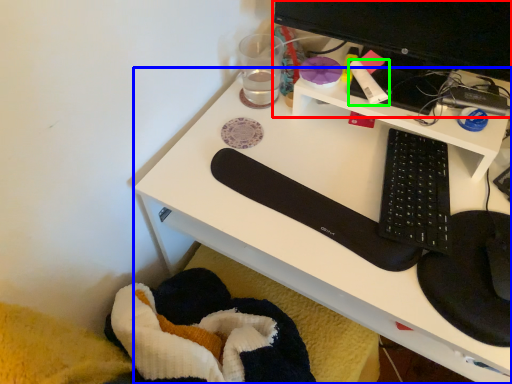
Question: Which object is positioned closest to desktop computer (highlighted by a red box)? Select from desk (highlighted by a blue box) and stationery (highlighted by a green box).

Choices:
 (A) desk
 (B) stationery

Answer: (B)